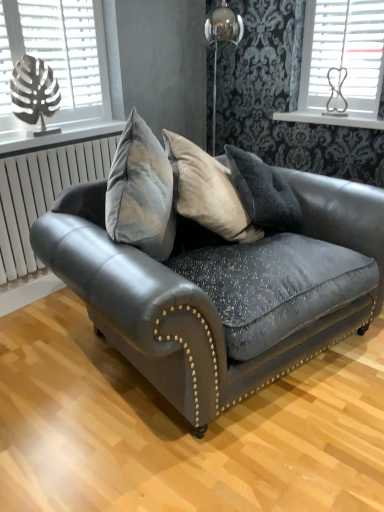
Where is `white metallic radiator at left`? The width and height of the screenshot is (384, 512). white metallic radiator at left is located at coordinates (42, 193).

Describe the element at coordinates (224, 290) in the screenshot. I see `velvet dark gray couch at center` at that location.

Describe the element at coordinates (331, 118) in the screenshot. I see `white wooden shelf at upper right` at that location.

Measure the distance between point (327, 56) and camera.

Point (327, 56) and camera are 8.76 feet apart from each other.

At what (x,y) coordinates should I click in order to perform the action: click on white metallic radiator at left. Please return your answer as a coordinate pair (x, y). This screenshot has height=512, width=384. Looking at the image, I should click on (42, 193).

In the scene shown: In the image, is metallic leaf at left, the second window positioned from the right, positioned in front of or behind velvet dark gray couch at center?

metallic leaf at left, the second window positioned from the right, is positioned farther from the viewer than velvet dark gray couch at center.

Is metallic leaf at left, the second window positioned from the right, next to velvet dark gray couch at center and touching it?

metallic leaf at left, the second window positioned from the right, and velvet dark gray couch at center are clearly separated.

Considering the points (60, 88) and (211, 264), which point is behind, point (60, 88) or point (211, 264)?

Point (60, 88)

I want to click on the 1st window behind the velvet dark gray couch at center, counting from the anchor's position, so click(x=57, y=56).

Which is more to the right, white metallic radiator at left or white wooden shelf at upper right?

From the viewer's perspective, white wooden shelf at upper right appears more on the right side.

Does white metallic radiator at left contain white wooden shelf at upper right?

No, white wooden shelf at upper right is not surrounded by white metallic radiator at left.

You are a GUI agent. You are given a task and a screenshot of the screen. Output one action in this format:
    pyautogui.click(x=<x>, y=<y>)
    Task: Click on the window sill to the right of white metallic radiator at left
    
    Given the screenshot: What is the action you would take?
    pyautogui.click(x=331, y=118)

Consider the image. From a real-world perspective, is white metallic radiator at left positioned above or below white wooden shelf at upper right?

From a real-world perspective, white metallic radiator at left is physically below white wooden shelf at upper right.

Is point (29, 170) less distant than point (332, 214)?

No, it is not.

Is velvet dark gray couch at center at the back of white metallic radiator at left?

No.

Which of these two, white metallic radiator at left or velvet dark gray couch at center, is bigger?

With larger size is velvet dark gray couch at center.

Which is less distant, (x=91, y=146) or (x=352, y=18)?

Clearly, point (x=91, y=146) is closer to the camera than point (x=352, y=18).

What's the angular difference between white metallic radiator at left and white plastic blinds at upper right, marked as the first window in a right-to-left arrangement,'s facing directions?

The facing directions of white metallic radiator at left and white plastic blinds at upper right, marked as the first window in a right-to-left arrangement, are 90.1 degrees apart.

Would you say white metallic radiator at left is a long distance from white plastic blinds at upper right, marked as the first window in a right-to-left arrangement?

That's right, there is a large distance between white metallic radiator at left and white plastic blinds at upper right, marked as the first window in a right-to-left arrangement.

Is white metallic radiator at left at the right side of white plastic blinds at upper right, marked as the first window in a right-to-left arrangement?

Incorrect, white metallic radiator at left is not on the right side of white plastic blinds at upper right, marked as the first window in a right-to-left arrangement.

Considering the sizes of objects white wooden shelf at upper right and metallic leaf at left, the 1th window when ordered from left to right, in the image provided, who is bigger, white wooden shelf at upper right or metallic leaf at left, the 1th window when ordered from left to right,?

metallic leaf at left, the 1th window when ordered from left to right, is bigger.

Which of these two, white wooden shelf at upper right or metallic leaf at left, the second window positioned from the right, is thinner?

Thinner between the two is metallic leaf at left, the second window positioned from the right.

From the image's perspective, between white wooden shelf at upper right and metallic leaf at left, the 1th window when ordered from left to right, which one is located above?

metallic leaf at left, the 1th window when ordered from left to right, from the image's perspective.

From a real-world perspective, between white plastic blinds at upper right, marked as the first window in a right-to-left arrangement, and velvet dark gray couch at center, who is vertically higher?

From a 3D spatial view, white plastic blinds at upper right, marked as the first window in a right-to-left arrangement, is above.

Who is bigger, white plastic blinds at upper right, the 2th window positioned from the left, or velvet dark gray couch at center?

With larger size is velvet dark gray couch at center.

From the image's perspective, is white plastic blinds at upper right, the 2th window positioned from the left, positioned above or below velvet dark gray couch at center?

Based on their image positions, white plastic blinds at upper right, the 2th window positioned from the left, is located above velvet dark gray couch at center.

Is white plastic blinds at upper right, the 2th window positioned from the left, positioned far away from velvet dark gray couch at center?

white plastic blinds at upper right, the 2th window positioned from the left, is far away from velvet dark gray couch at center.

Locate an element on the screen. The width and height of the screenshot is (384, 512). window below the white plastic blinds at upper right, marked as the first window in a right-to-left arrangement (from a real-world perspective) is located at coordinates (57, 56).

Is white plastic blinds at upper right, the 2th window positioned from the left, at the right side of metallic leaf at left, the 1th window when ordered from left to right?

Yes.

From the image's perspective, is white plastic blinds at upper right, marked as the first window in a right-to-left arrangement, on top of metallic leaf at left, the 1th window when ordered from left to right?

Yes.

This screenshot has height=512, width=384. Find the location of `studio couch in front of the metallic leaf at left, the second window positioned from the right`. studio couch in front of the metallic leaf at left, the second window positioned from the right is located at coordinates (224, 290).

Locate an element on the screen. This screenshot has height=512, width=384. radiator on the left of the white wooden shelf at upper right is located at coordinates (42, 193).

Considering their positions, is white plastic blinds at upper right, the 2th window positioned from the left, positioned closer to white wooden shelf at upper right than white metallic radiator at left?

white plastic blinds at upper right, the 2th window positioned from the left.

Considering their positions, is white metallic radiator at left positioned further to velvet dark gray couch at center than metallic leaf at left, the second window positioned from the right?

metallic leaf at left, the second window positioned from the right, lies further to velvet dark gray couch at center than the other object.

Estimate the real-world distances between objects in this image. Which object is closer to white plastic blinds at upper right, the 2th window positioned from the left, metallic leaf at left, the 1th window when ordered from left to right, or velvet dark gray couch at center?

velvet dark gray couch at center lies closer to white plastic blinds at upper right, the 2th window positioned from the left, than the other object.

Estimate the real-world distances between objects in this image. Which object is further from white wooden shelf at upper right, velvet dark gray couch at center or white plastic blinds at upper right, the 2th window positioned from the left?

The object further to white wooden shelf at upper right is velvet dark gray couch at center.

Which object lies further to the anchor point white metallic radiator at left, white wooden shelf at upper right or metallic leaf at left, the 1th window when ordered from left to right?

The object further to white metallic radiator at left is white wooden shelf at upper right.

Based on their spatial positions, is white plastic blinds at upper right, marked as the first window in a right-to-left arrangement, or metallic leaf at left, the 1th window when ordered from left to right, further from velvet dark gray couch at center?

white plastic blinds at upper right, marked as the first window in a right-to-left arrangement.

When comparing their distances from white wooden shelf at upper right, does metallic leaf at left, the second window positioned from the right, or velvet dark gray couch at center seem further?

metallic leaf at left, the second window positioned from the right, lies further to white wooden shelf at upper right than the other object.

Consider the image. Which object lies further to the anchor point white metallic radiator at left, metallic leaf at left, the second window positioned from the right, or velvet dark gray couch at center?

The object further to white metallic radiator at left is velvet dark gray couch at center.

Find the location of a particular element. radiator between metallic leaf at left, the 1th window when ordered from left to right, and velvet dark gray couch at center, in the vertical direction is located at coordinates (42, 193).

This screenshot has height=512, width=384. Identify the location of studio couch located between metallic leaf at left, the 1th window when ordered from left to right, and white plastic blinds at upper right, marked as the first window in a right-to-left arrangement, in the left-right direction. 224,290.

At what (x,y) coordinates should I click in order to perform the action: click on radiator located between metallic leaf at left, the second window positioned from the right, and white plastic blinds at upper right, the 2th window positioned from the left, in the left-right direction. Please return your answer as a coordinate pair (x, y). Image resolution: width=384 pixels, height=512 pixels. Looking at the image, I should click on (42, 193).

In order to click on studio couch between white metallic radiator at left and white plastic blinds at upper right, the 2th window positioned from the left in this screenshot , I will do `click(224, 290)`.